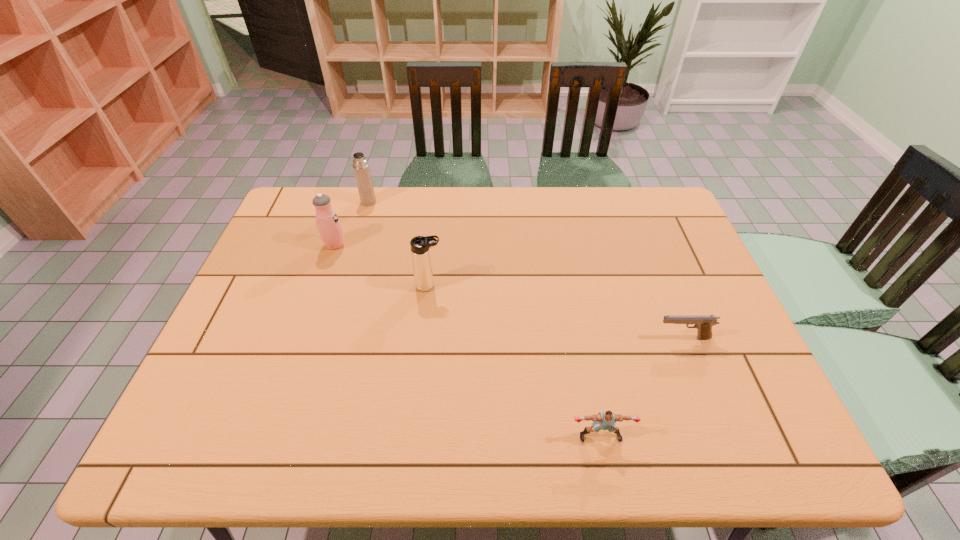
Find the location of a particular element. The width and height of the screenshot is (960, 540). the fourth nearest object is located at coordinates (328, 224).

Locate an element on the screen. the leftmost object is located at coordinates click(328, 224).

At what (x,y) coordinates should I click in order to perform the action: click on the farthest object. Please return your answer as a coordinate pair (x, y). Looking at the image, I should click on (361, 168).

Locate an element on the screen. The height and width of the screenshot is (540, 960). the fourth object from right to left is located at coordinates (361, 168).

What are the coordinates of `the third object from right to left` in the screenshot? It's located at (421, 259).

This screenshot has height=540, width=960. In order to click on the rightmost thermos bottle in this screenshot , I will do `click(421, 259)`.

This screenshot has width=960, height=540. Identify the location of puncher. (606, 420).

What are the coordinates of `the nearest object` in the screenshot? It's located at (606, 420).

Where is `the rightmost object`? the rightmost object is located at coordinates (703, 323).

The width and height of the screenshot is (960, 540). I want to click on pistol, so click(x=703, y=323).